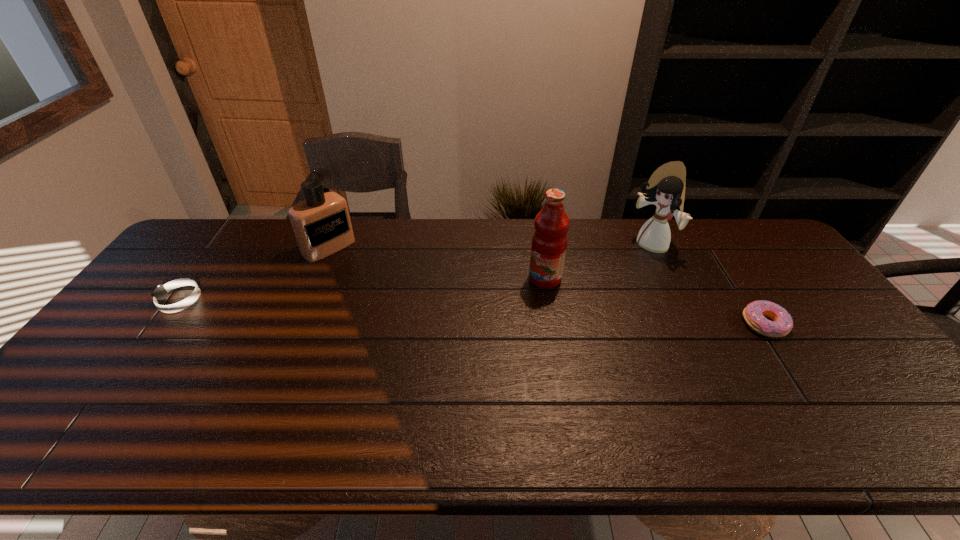
Where is `vacant spot on the desktop that is between the leftmost object and the rightmost object and is positioned on the front label of the perfume`? The image size is (960, 540). vacant spot on the desktop that is between the leftmost object and the rightmost object and is positioned on the front label of the perfume is located at coordinates (404, 309).

Where is `free space on the desktop that is between the leftmost object and the rightmost object and is positioned at the front face of the fourth object from left to right`? free space on the desktop that is between the leftmost object and the rightmost object and is positioned at the front face of the fourth object from left to right is located at coordinates (540, 315).

Locate an element on the screen. free space on the desktop that is between the wristband and the rightmost object and is positioned on the front label of the third object from right to left is located at coordinates (474, 312).